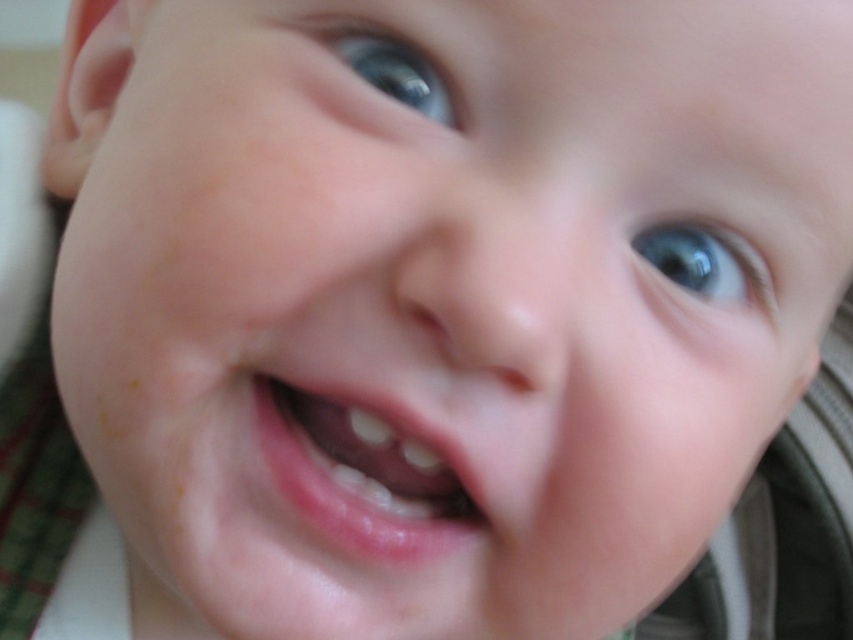
Question: Can you confirm if pink glossy lips at center is bigger than blue glossy eye at upper right?

Choices:
 (A) no
 (B) yes

Answer: (B)

Question: Which point is farther to the camera?

Choices:
 (A) (643, 244)
 (B) (395, 99)
 (C) (263, 424)

Answer: (A)

Question: Which of the following is the farthest from the observer?

Choices:
 (A) blue glossy eye at upper right
 (B) blue glossy eye at upper center

Answer: (A)

Question: Considering the real-world distances, which object is farthest from the pink glossy lips at center?

Choices:
 (A) blue glossy eye at upper right
 (B) blue glossy eye at upper center

Answer: (A)

Question: Is pink glossy lips at center thinner than blue glossy eye at upper right?

Choices:
 (A) yes
 (B) no

Answer: (B)

Question: Can you confirm if blue glossy eye at upper right is positioned below blue glossy eye at upper center?

Choices:
 (A) yes
 (B) no

Answer: (A)